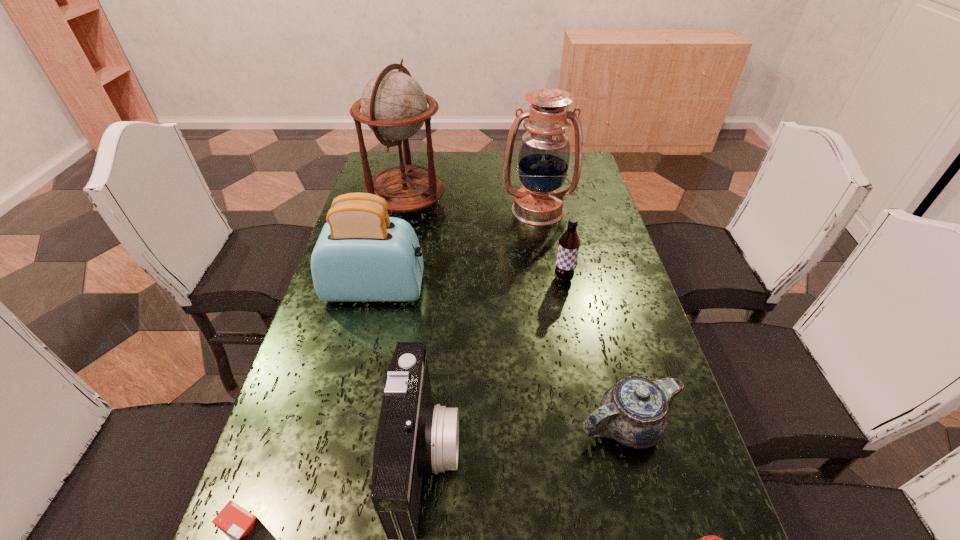
Find the location of a particular element. globe is located at coordinates (394, 106).

Find the location of a particular element. This screenshot has width=960, height=540. the seventh shortest object is located at coordinates (544, 155).

The image size is (960, 540). Find the location of `the third tallest object`. the third tallest object is located at coordinates (362, 255).

You are a GUI agent. You are given a task and a screenshot of the screen. Output one action in this format:
    pyautogui.click(x=<x>, y=<y>)
    Task: Click on the root beer
    
    Given the screenshot: What is the action you would take?
    pyautogui.click(x=569, y=243)

The height and width of the screenshot is (540, 960). I want to click on chinaware, so click(x=634, y=412).

This screenshot has height=540, width=960. In order to click on vacant area situated 0.230m on the surface of the globe in this screenshot , I will do `click(514, 204)`.

Find the location of a particular element. free location located on the left of the oil lamp is located at coordinates (398, 210).

At what (x,y) coordinates should I click in order to perform the action: click on free space located on the side of the toaster with the lever. Please return your answer as a coordinate pair (x, y). Image resolution: width=960 pixels, height=540 pixels. Looking at the image, I should click on (542, 289).

Where is `free location located 0.140m on the left of the root beer`? This screenshot has width=960, height=540. free location located 0.140m on the left of the root beer is located at coordinates (502, 280).

This screenshot has height=540, width=960. In order to click on vacant space located 0.340m from the spout of the chinaware in this screenshot , I will do `click(410, 426)`.